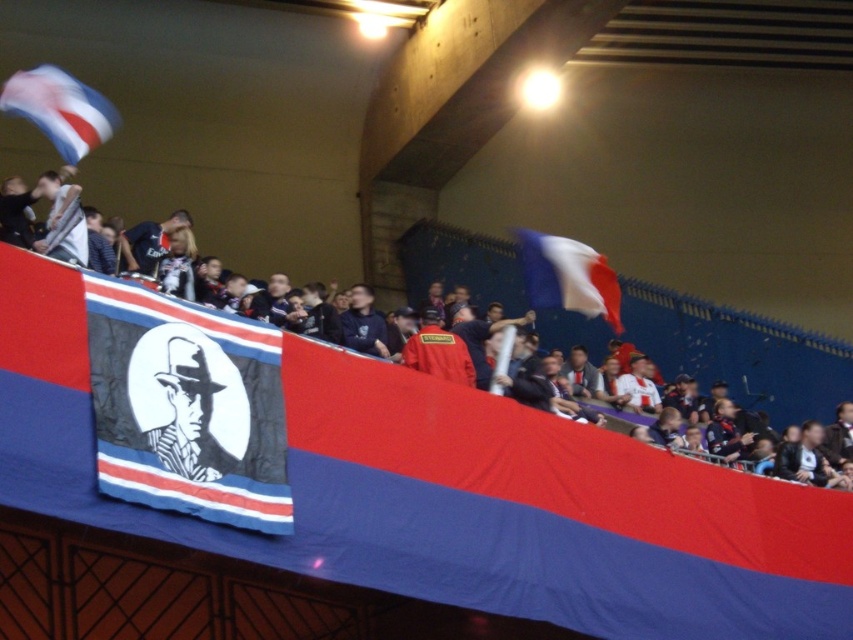
You are a photographer trying to capture a photo of the white fabric flag at upper center without the black and white fabric banner at center blocking it. Based on their positions, can you suggest a direction to move so that the banner is no longer in the way?

The black and white fabric banner at center is positioned on the left side of the white fabric flag at upper center. To avoid the banner blocking the flag, move to the right side of the flag so that the banner is out of the frame.